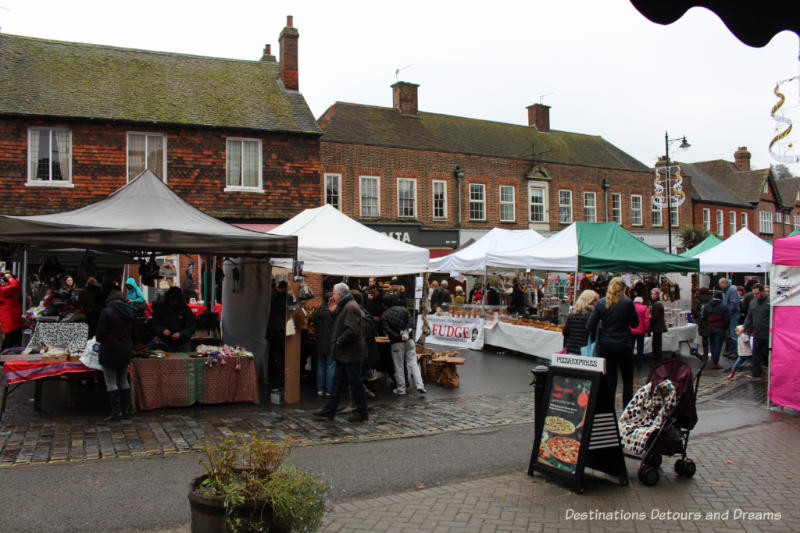
I want to click on holiday decoration, so click(x=658, y=191).